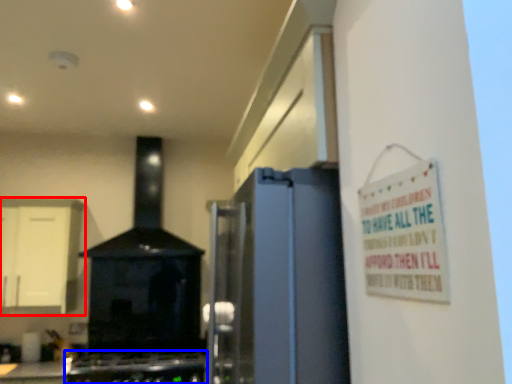
Question: Which of the following is the farthest to the observer, cabinetry (highlighted by a red box) or gas stove (highlighted by a blue box)?

Choices:
 (A) cabinetry
 (B) gas stove

Answer: (A)